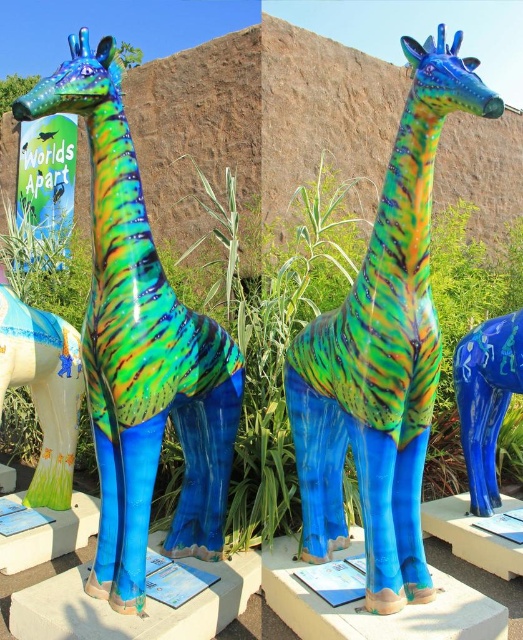
Question: Which object is the closest to the matte ceramic elephant at lower left?

Choices:
 (A) glossy ceramic giraffe at center
 (B) blue glossy giraffe at lower right

Answer: (A)

Question: Which is farther from the matte ceramic elephant at lower left?

Choices:
 (A) shiny ceramic giraffe at center
 (B) blue glossy giraffe at lower right
 (C) glossy ceramic giraffe at center

Answer: (B)

Question: Is shiny ceramic giraffe at center positioned at the back of matte ceramic elephant at lower left?

Choices:
 (A) no
 (B) yes

Answer: (A)

Question: Is glossy ceramic giraffe at center above blue glossy giraffe at lower right?

Choices:
 (A) yes
 (B) no

Answer: (A)

Question: Does glossy ceramic giraffe at center have a smaller size compared to matte ceramic elephant at lower left?

Choices:
 (A) yes
 (B) no

Answer: (B)

Question: Which object is positioned closest to the shiny ceramic giraffe at center?

Choices:
 (A) glossy ceramic giraffe at center
 (B) matte ceramic elephant at lower left
 (C) blue glossy giraffe at lower right

Answer: (A)